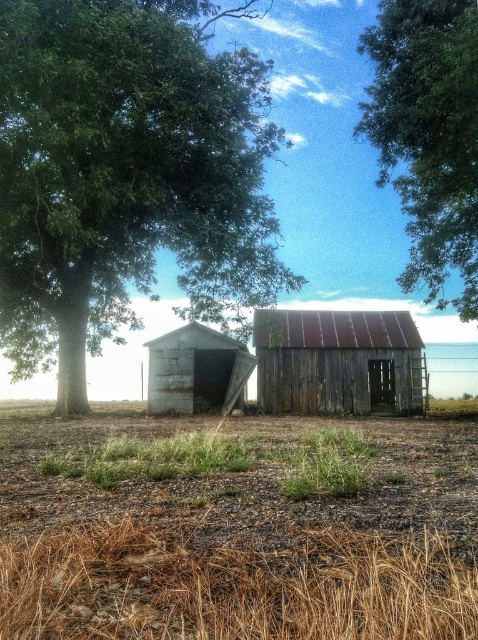
Question: Which object appears farthest from the camera in this image?

Choices:
 (A) brown soil at center
 (B) weathered wood shed at center
 (C) green leafy tree at upper center
 (D) green leafy tree at left

Answer: (B)

Question: Does brown soil at center appear under rusty metal shed at center?

Choices:
 (A) no
 (B) yes

Answer: (A)

Question: Which object is closer to the camera taking this photo?

Choices:
 (A) weathered wood shed at center
 (B) green leafy tree at left
 (C) brown soil at center
 (D) rusty metal shed at center

Answer: (C)

Question: Which object is farther from the camera taking this photo?

Choices:
 (A) green leafy tree at left
 (B) green leafy tree at upper center
 (C) brown soil at center

Answer: (B)

Question: Where is brown soil at center located in relation to weathered wood shed at center in the image?

Choices:
 (A) below
 (B) above

Answer: (A)

Question: Is green leafy tree at upper center thinner than weathered wood shed at center?

Choices:
 (A) yes
 (B) no

Answer: (B)